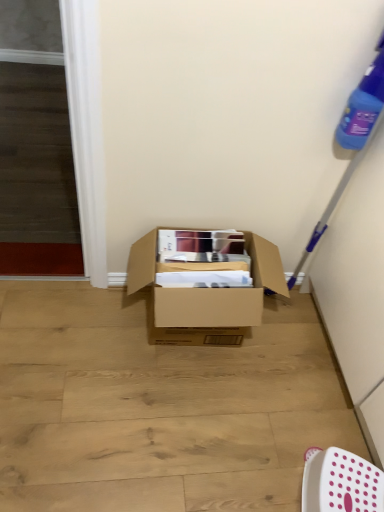
Question: Is white plastic chair at lower right taller or shorter than brown cardboard box at center?

Choices:
 (A) tall
 (B) short

Answer: (B)

Question: Looking at the image, does white plastic chair at lower right seem bigger or smaller compared to brown cardboard box at center?

Choices:
 (A) big
 (B) small

Answer: (B)

Question: From a real-world perspective, is white plastic chair at lower right physically located above or below brown cardboard box at center?

Choices:
 (A) below
 (B) above

Answer: (A)

Question: In the image, is brown cardboard box at center positioned in front of or behind white plastic chair at lower right?

Choices:
 (A) behind
 (B) front

Answer: (A)

Question: Considering the positions of brown cardboard box at center and white plastic chair at lower right in the image, is brown cardboard box at center bigger or smaller than white plastic chair at lower right?

Choices:
 (A) big
 (B) small

Answer: (A)

Question: Do you think brown cardboard box at center is within white plastic chair at lower right, or outside of it?

Choices:
 (A) inside
 (B) outside

Answer: (B)

Question: From a real-world perspective, is brown cardboard box at center above or below white plastic chair at lower right?

Choices:
 (A) above
 (B) below

Answer: (A)